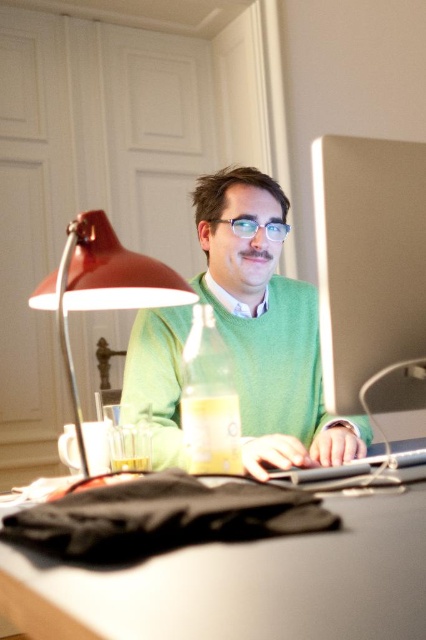
You are a tailor measuring garments for alterations. You see the green matte sweater at center and the translucent yellow bottle at center on the desk. Which object requires a vertical measurement to ensure proper alterations?

The green matte sweater at center requires a vertical measurement for alterations since it has a greater height compared to the translucent yellow bottle at center.

You are organizing the desk and want to place the translucent glass beverage at desk center on the black matte table at lower center. Can you confirm if the table is wide enough to accommodate the beverage without it hanging off the edge?

The black matte table at lower center might be wider than the translucent glass beverage at desk center, so there is a possibility that the beverage can be placed safely on the table without overhanging.